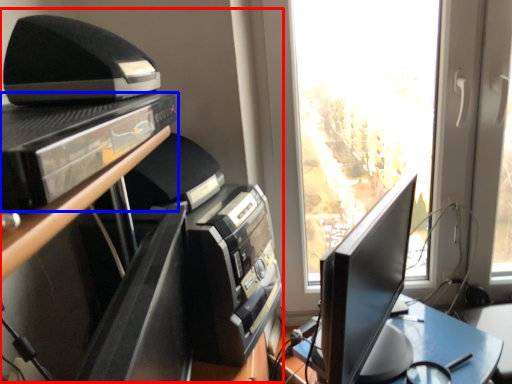
Question: Which point is further to the camera, entertainment center (highlighted by a red box) or shelf (highlighted by a blue box)?

Choices:
 (A) entertainment center
 (B) shelf

Answer: (A)